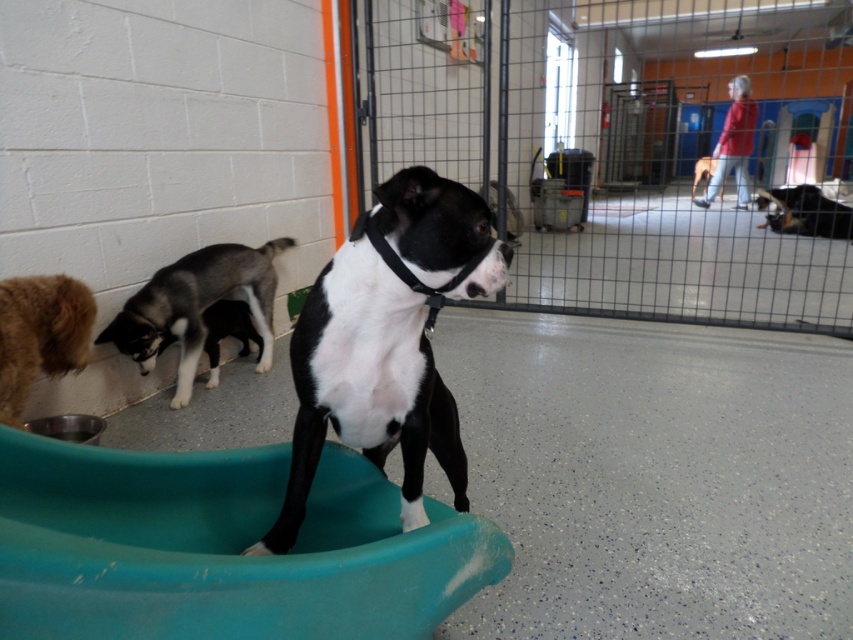
Question: Which object is closer to the camera taking this photo?

Choices:
 (A) gray fur dog at lower left
 (B) black matte dog at center

Answer: (B)

Question: Is gray fur dog at lower left further to camera compared to black smooth dog at center?

Choices:
 (A) no
 (B) yes

Answer: (A)

Question: Which object is closer to the camera taking this photo?

Choices:
 (A) black smooth dog at center
 (B) black glossy dog at upper right
 (C) gray fur dog at lower left
 (D) brown fluffy dog at lower left

Answer: (D)

Question: Which point is farther from the camera taking this photo?

Choices:
 (A) (718, 193)
 (B) (180, 291)

Answer: (A)

Question: Does gray fur dog at lower left appear on the right side of brown fluffy dog at lower left?

Choices:
 (A) no
 (B) yes

Answer: (B)

Question: From the image, what is the correct spatial relationship of gray fur dog at lower left in relation to brown fluffy dog at lower left?

Choices:
 (A) below
 (B) above

Answer: (B)